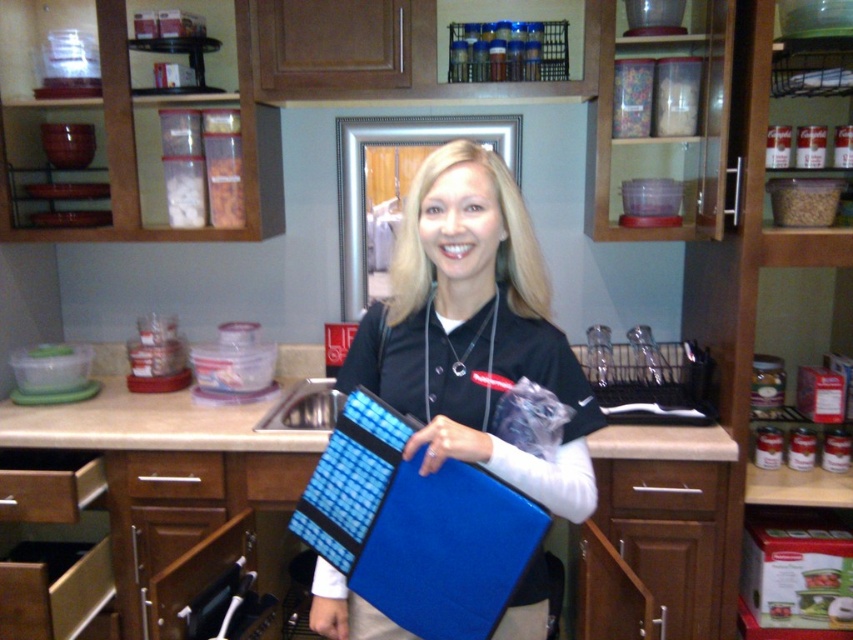
Question: Is blue fabric folder at center positioned in front of wooden drawer at lower center?

Choices:
 (A) no
 (B) yes

Answer: (B)

Question: Which point is farther from the camera taking this photo?

Choices:
 (A) (296, 474)
 (B) (126, 465)

Answer: (B)

Question: Which point is farther to the camera?

Choices:
 (A) wooden drawer at lower left
 (B) wooden drawer at lower center

Answer: (B)

Question: Which point is closer to the camera?

Choices:
 (A) brown wood drawer at lower left
 (B) blue fabric folder at center
 (C) brown wood drawer at center

Answer: (B)

Question: Is wooden drawer at lower left below brown wood drawer at center?

Choices:
 (A) yes
 (B) no

Answer: (B)

Question: Can you confirm if brown wood drawer at center is positioned above wooden drawer at lower center?

Choices:
 (A) yes
 (B) no

Answer: (B)